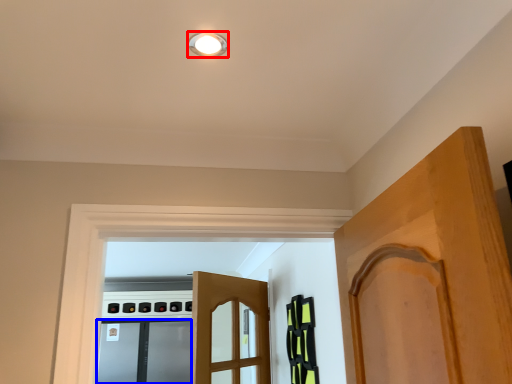
Question: Which point is further to the camera, light fixture (highlighted by a red box) or screen door (highlighted by a blue box)?

Choices:
 (A) light fixture
 (B) screen door

Answer: (B)